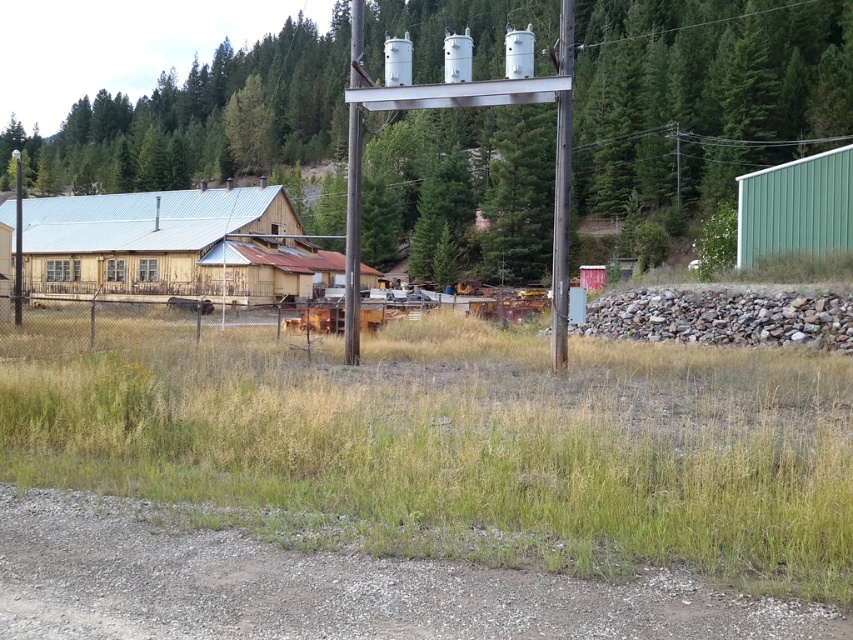
You are standing at the point labeled as point (561, 189) in the image. What object is located exactly at that point?

The point (561, 189) indicates a metallic gray pole at center.

You are a gardener trying to mow the lawn. You see the green grass at center and the metallic gray pole at center. Which area should you avoid mowing to prevent damaging the pole?

You should avoid mowing near the metallic gray pole at center because the green grass at center is wider than the pole, meaning the pole is narrower and could be easily hit by the mower.